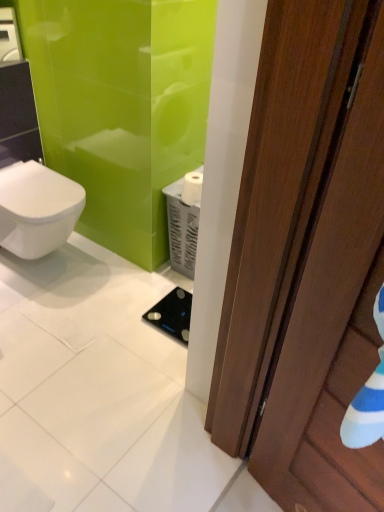
Question: Can you confirm if black glass scale at center is smaller than white matte toilet paper at center?

Choices:
 (A) yes
 (B) no

Answer: (A)

Question: Considering the relative sizes of black glass scale at center and white matte toilet paper at center in the image provided, is black glass scale at center thinner than white matte toilet paper at center?

Choices:
 (A) yes
 (B) no

Answer: (B)

Question: From a real-world perspective, is black glass scale at center beneath white matte toilet paper at center?

Choices:
 (A) yes
 (B) no

Answer: (A)

Question: Is white matte toilet paper at center inside black glass scale at center?

Choices:
 (A) no
 (B) yes

Answer: (A)

Question: From the image's perspective, is black glass scale at center over white matte toilet paper at center?

Choices:
 (A) no
 (B) yes

Answer: (A)

Question: Based on their sizes in the image, would you say brown wooden door at right is bigger or smaller than black glass scale at center?

Choices:
 (A) big
 (B) small

Answer: (A)

Question: Is brown wooden door at right in front of or behind black glass scale at center in the image?

Choices:
 (A) front
 (B) behind

Answer: (A)

Question: From the image's perspective, is brown wooden door at right positioned above or below black glass scale at center?

Choices:
 (A) below
 (B) above

Answer: (B)

Question: Looking at their shapes, would you say brown wooden door at right is wider or thinner than black glass scale at center?

Choices:
 (A) wide
 (B) thin

Answer: (B)

Question: Considering the positions of white matte toilet paper at center and black glass scale at center in the image, is white matte toilet paper at center wider or thinner than black glass scale at center?

Choices:
 (A) thin
 (B) wide

Answer: (A)

Question: From a real-world perspective, is white matte toilet paper at center positioned above or below black glass scale at center?

Choices:
 (A) above
 (B) below

Answer: (A)

Question: From the image's perspective, is white matte toilet paper at center positioned above or below black glass scale at center?

Choices:
 (A) above
 (B) below

Answer: (A)

Question: Is white matte toilet paper at center situated inside black glass scale at center or outside?

Choices:
 (A) outside
 (B) inside

Answer: (A)

Question: In terms of height, does white glossy bidet at left look taller or shorter compared to brown wooden door at right?

Choices:
 (A) short
 (B) tall

Answer: (A)

Question: From the image's perspective, is white glossy bidet at left positioned above or below brown wooden door at right?

Choices:
 (A) above
 (B) below

Answer: (A)